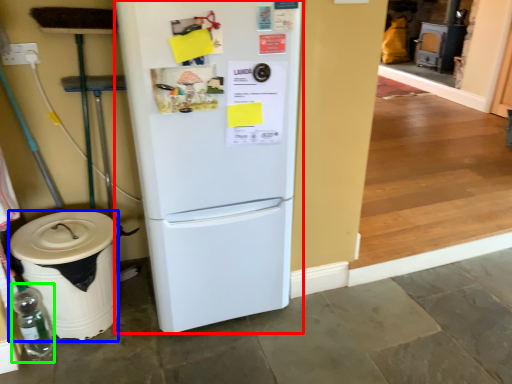
Question: Which is nearer to the refrigerator (highlighted by a red box)? trash bin/can (highlighted by a blue box) or bottle (highlighted by a green box).

Choices:
 (A) trash bin/can
 (B) bottle

Answer: (A)